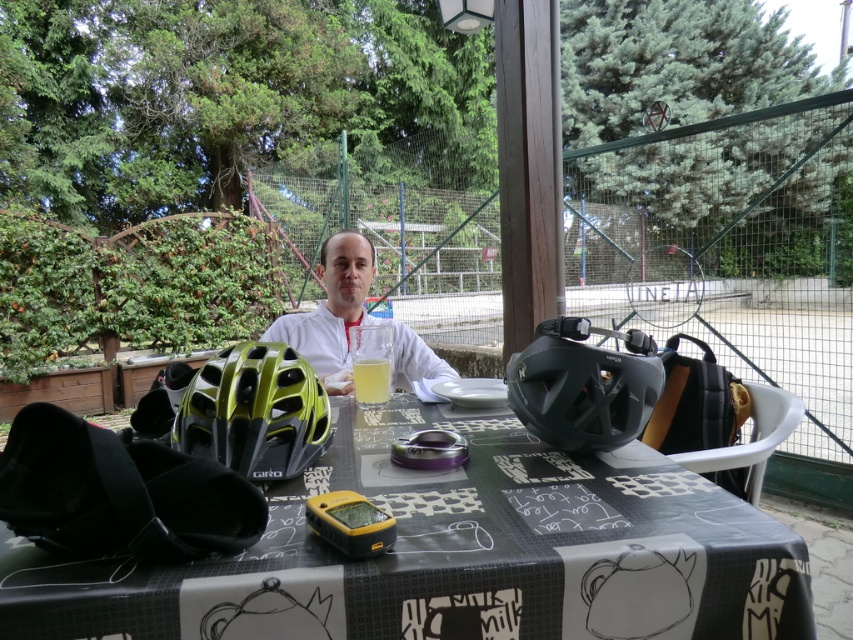
You are a customer at the outdoor cafe and want to place your phone on the table without it tipping over. Considering the white matte shirt at center and the translucent glass at center, which object should you place it on to ensure stability?

The white matte shirt at center has a larger width than the translucent glass at center, so placing the phone on the white matte shirt at center would provide a more stable surface.

What are the coordinates of the black matte table at center?

The black matte table at center is located at point (453, 554).

You are a customer at the outdoor cafe and want to place your phone on the table without it sliding off. Which object should you place it on to ensure stability, the white matte shirt at center or the translucent glass at center?

The white matte shirt at center is located above the translucent glass at center, so placing the phone on the white matte shirt at center would provide a stable surface since it is not elevated like the glass.